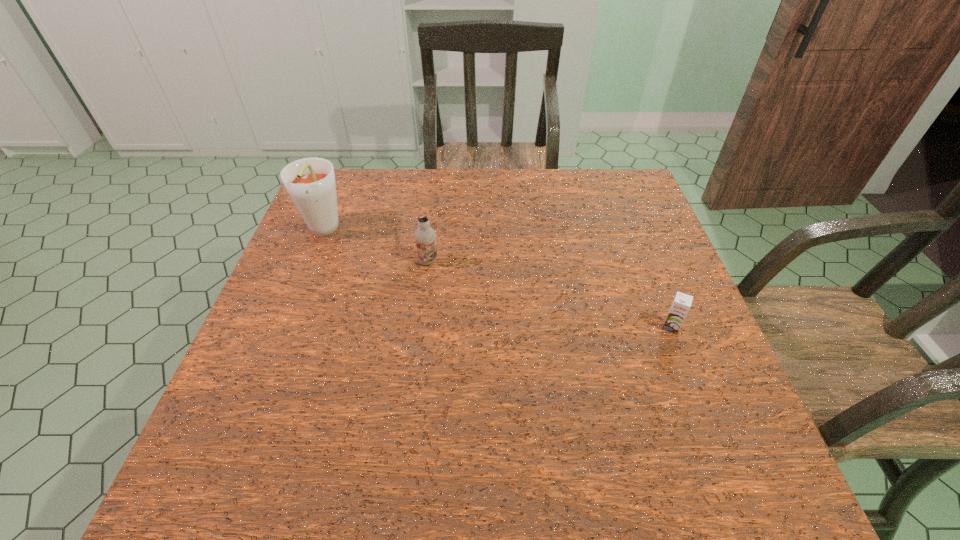
I want to click on object positioned at the left edge, so click(310, 182).

Identify the location of object present at the right edge. (682, 302).

At what (x,y) coordinates should I click in order to perform the action: click on object that is positioned at the far left corner. Please return your answer as a coordinate pair (x, y). The height and width of the screenshot is (540, 960). Looking at the image, I should click on (310, 182).

In the image, there is a desktop. Where is `vacant space at the far edge`? This screenshot has width=960, height=540. vacant space at the far edge is located at coordinates (592, 212).

This screenshot has width=960, height=540. In order to click on vacant region at the near edge of the desktop in this screenshot , I will do `click(395, 471)`.

The width and height of the screenshot is (960, 540). I want to click on free space at the left edge of the desktop, so click(301, 260).

The image size is (960, 540). What are the coordinates of `free space at the right edge of the desktop` in the screenshot? It's located at (655, 246).

The width and height of the screenshot is (960, 540). I want to click on vacant space at the far left corner, so click(355, 203).

I want to click on vacant area at the near left corner of the desktop, so click(289, 450).

At what (x,y) coordinates should I click in order to perform the action: click on blank space at the near right corner. Please return your answer as a coordinate pair (x, y). The width and height of the screenshot is (960, 540). Looking at the image, I should click on [771, 472].